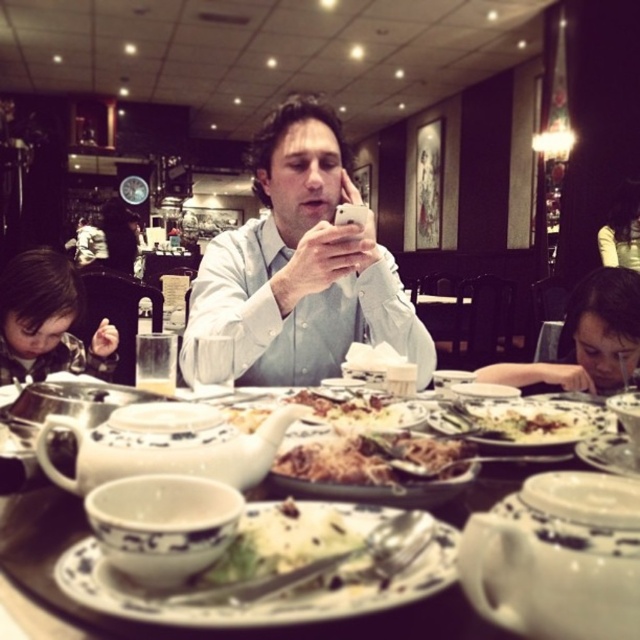
You are a server in a restaurant and need to deliver a dish to the customer. The customer is sitting at the table with the white ceramic plate at center and matte black hair at upper right. Which object should you focus on to place the new dish?

You should focus on the white ceramic plate at center because it is below the matte black hair at upper right, indicating it is on the table where the customer is seated.